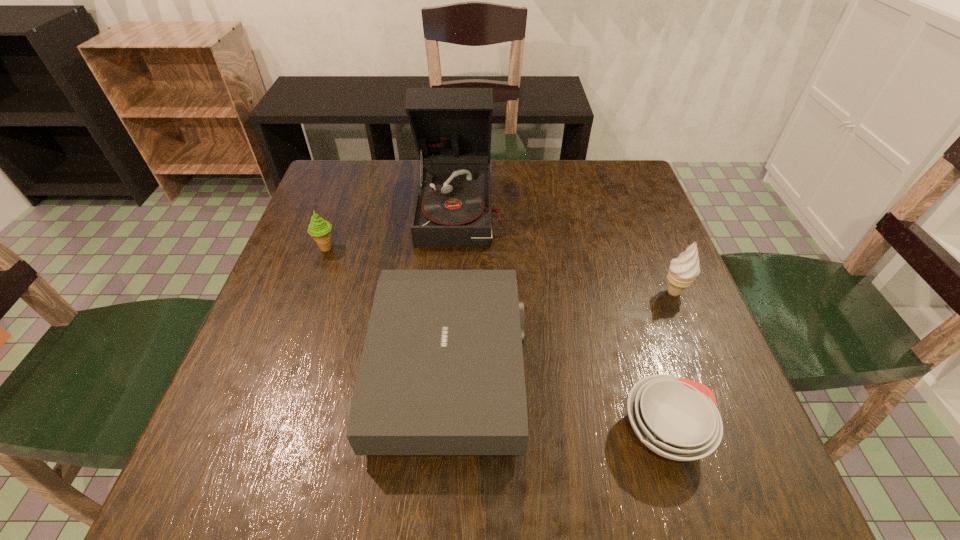
Find the location of a particular element. The image size is (960, 540). the tallest object is located at coordinates (451, 127).

The image size is (960, 540). I want to click on the taller icecream, so click(683, 270).

I want to click on the second tallest object, so click(683, 270).

At what (x,y) coordinates should I click in order to perform the action: click on the left icecream. Please return your answer as a coordinate pair (x, y). The width and height of the screenshot is (960, 540). Looking at the image, I should click on (319, 229).

Image resolution: width=960 pixels, height=540 pixels. I want to click on the farther icecream, so click(319, 229).

This screenshot has height=540, width=960. I want to click on projector, so click(x=441, y=372).

At what (x,y) coordinates should I click in order to perform the action: click on the fourth object from left to right. Please return your answer as a coordinate pair (x, y). Image resolution: width=960 pixels, height=540 pixels. Looking at the image, I should click on (677, 418).

The height and width of the screenshot is (540, 960). Find the location of `the shortest object`. the shortest object is located at coordinates (677, 418).

I want to click on blank space located 0.110m on the front-facing side of the tallest object, so click(462, 281).

Where is `vacant space located on the front-facing side of the taller icecream`? The height and width of the screenshot is (540, 960). vacant space located on the front-facing side of the taller icecream is located at coordinates (564, 292).